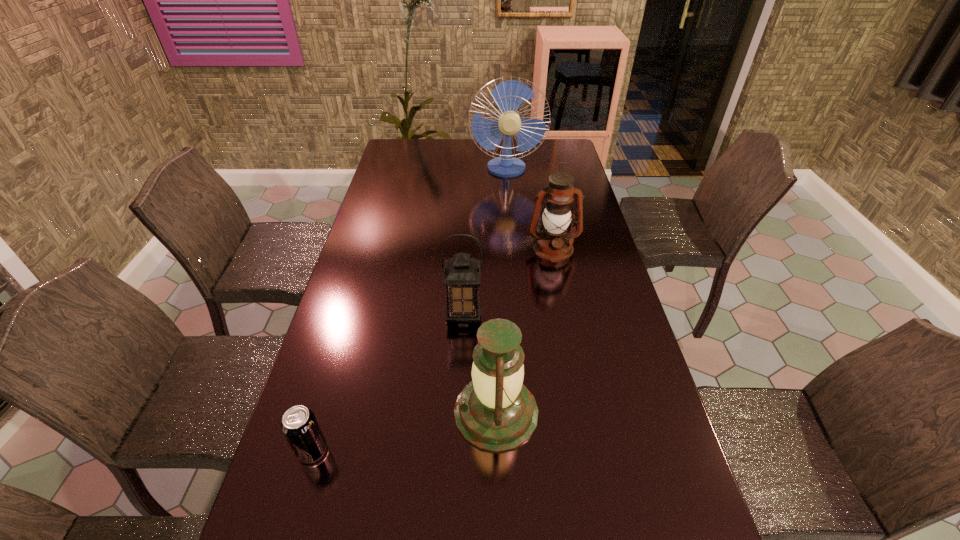
Image resolution: width=960 pixels, height=540 pixels. I want to click on vacant space situated on the back of the third farthest object, so [465, 284].

In order to click on free space located with the light compartment facing forward on the nearest lantern in this screenshot , I will do `click(375, 412)`.

The width and height of the screenshot is (960, 540). I want to click on vacant space located 0.380m with the light compartment facing forward on the nearest lantern, so click(x=297, y=412).

The height and width of the screenshot is (540, 960). Identify the location of vacant space situated 0.250m with the light compartment facing forward on the nearest lantern. click(x=350, y=412).

Where is `free space located on the front of the soda can`? The width and height of the screenshot is (960, 540). free space located on the front of the soda can is located at coordinates (291, 524).

Locate an element on the screen. This screenshot has width=960, height=540. object that is at the far edge is located at coordinates (509, 95).

You are a GUI agent. You are given a task and a screenshot of the screen. Output one action in this format:
    pyautogui.click(x=<x>, y=<y>)
    Task: Click on the object at the left edge
    
    Given the screenshot: What is the action you would take?
    pyautogui.click(x=299, y=425)

The height and width of the screenshot is (540, 960). I want to click on fan that is at the right edge, so click(x=509, y=95).

Locate an element on the screen. The height and width of the screenshot is (540, 960). lantern situated at the right edge is located at coordinates (553, 243).

Where is `object located in the far right corner section of the desktop`? The height and width of the screenshot is (540, 960). object located in the far right corner section of the desktop is located at coordinates (509, 95).